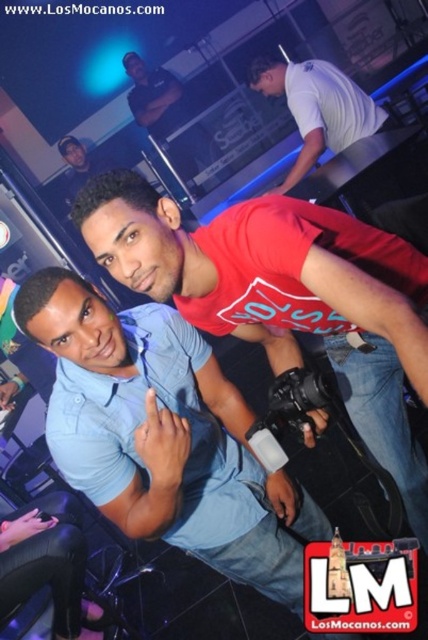
You are organizing a photo shoot and need to ensure that the white matte shirt at upper center and the matte black shirt at upper center are visible in the frame. Based on their positions and sizes, which shirt do you think might require more space in the composition?

The white matte shirt at upper center might require more space in the composition since it is wider than the matte black shirt at upper center according to the description.

You are at a party and want to take a photo of the two people represented by the points. The first point is at coordinates point [285,236] and the second is at point [305,61]. To ensure both are in focus, which point should you focus on?

You should focus on point [285,236] because it is closer to the viewer, ensuring both points will be in focus when using a suitable aperture.